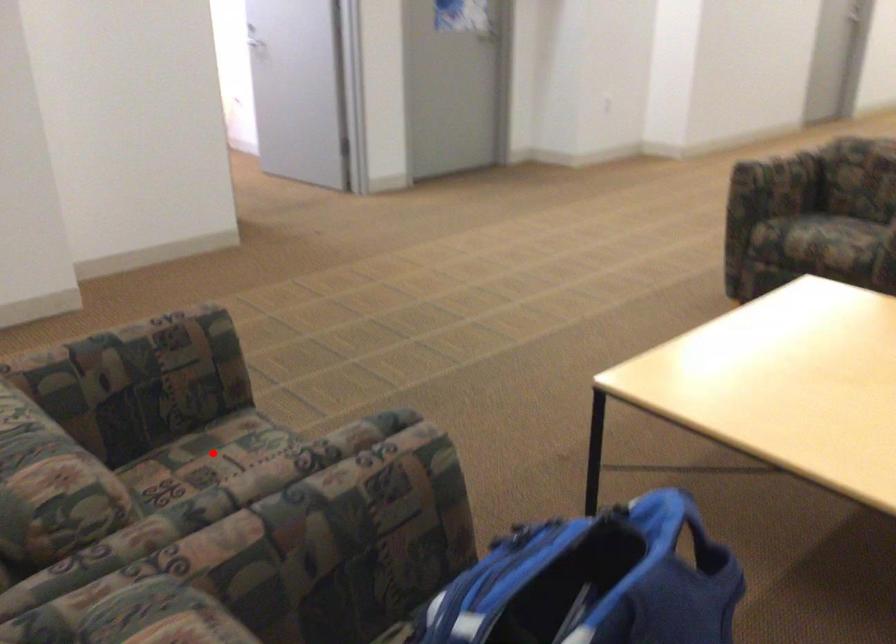
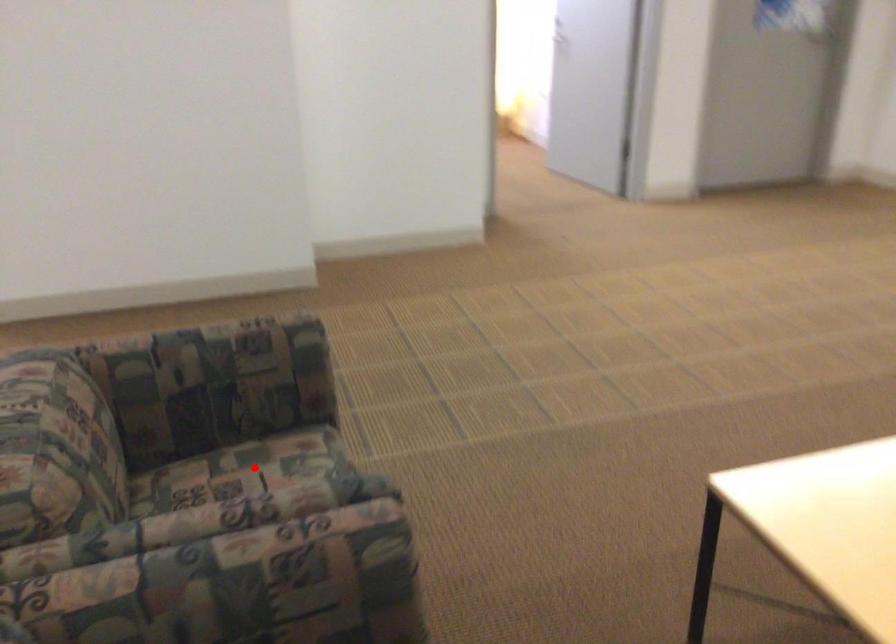
I am providing you with two images of the same scene from different viewpoints. A red point is marked on the first image and another point is marked on the second image. Is the marked point in image1 the same physical position as the marked point in image2?

Yes